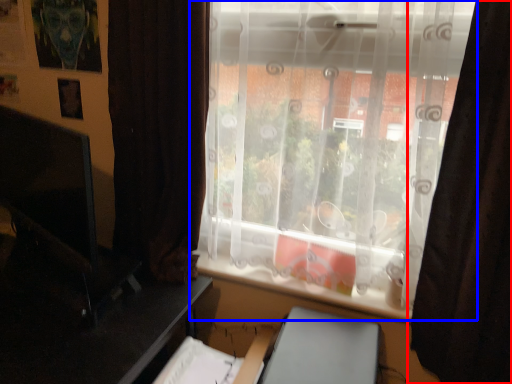
Question: Which point is closer to the camera, curtain (highlighted by a red box) or window (highlighted by a blue box)?

Choices:
 (A) curtain
 (B) window

Answer: (A)